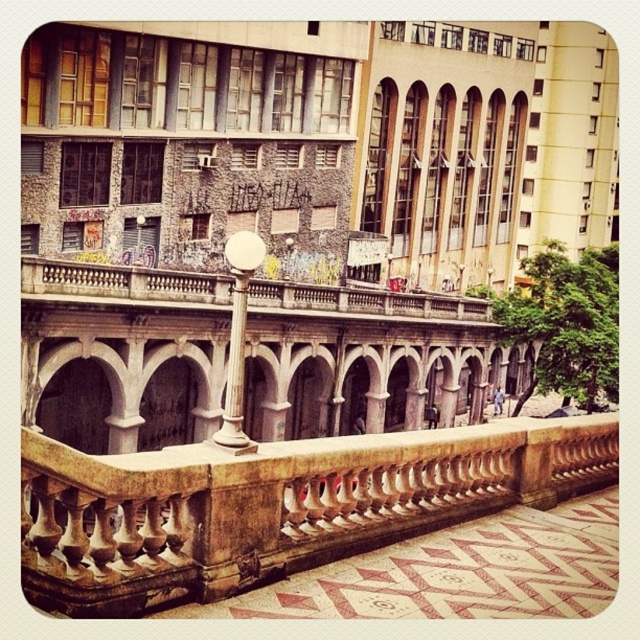
Question: Which of the following is the closest to the observer?

Choices:
 (A) tap(225, 419)
 (B) tap(208, 532)

Answer: (B)

Question: Considering the relative positions of stone balustrade at center and white marble lamp post at center in the image provided, where is stone balustrade at center located with respect to white marble lamp post at center?

Choices:
 (A) right
 (B) left

Answer: (A)

Question: Is stone balustrade at center thinner than white marble lamp post at center?

Choices:
 (A) yes
 (B) no

Answer: (B)

Question: Is stone balustrade at center smaller than white marble lamp post at center?

Choices:
 (A) yes
 (B) no

Answer: (B)